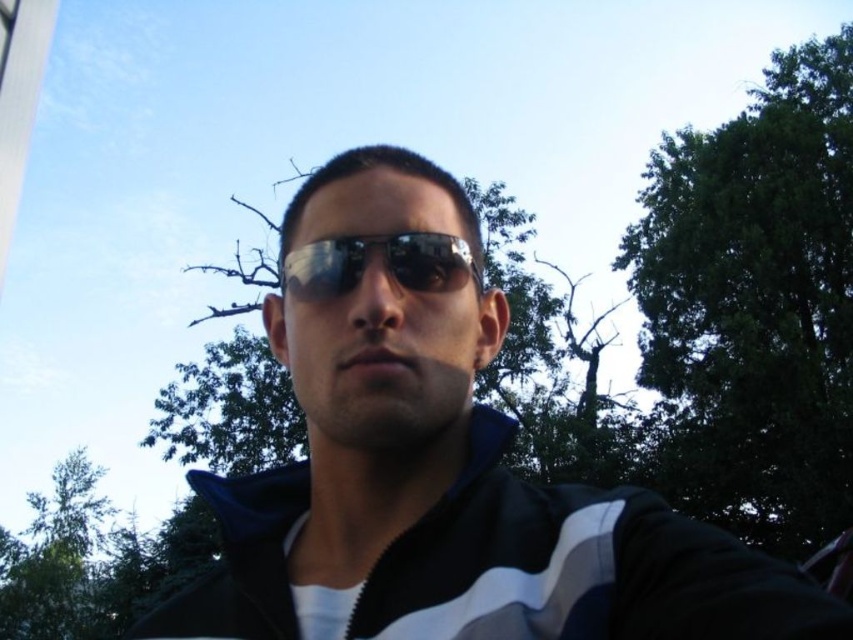
Who is shorter, black matte sunglasses at center or shiny reflective sunglasses at center?

Standing shorter between the two is shiny reflective sunglasses at center.

Find the location of `black matte sunglasses at center`. black matte sunglasses at center is located at coordinates (451, 508).

Where is `black matte sunglasses at center`? black matte sunglasses at center is located at coordinates (451, 508).

The image size is (853, 640). In order to click on black matte sunglasses at center in this screenshot , I will do `click(451, 508)`.

In the scene shown: Which of these two, black/white jacket at center or shiny reflective sunglasses at center, stands taller?

black/white jacket at center

Which is in front, point (239, 497) or point (479, 278)?

Point (239, 497)

The height and width of the screenshot is (640, 853). Find the location of `black/white jacket at center`. black/white jacket at center is located at coordinates (576, 566).

Where is `black/white jacket at center`? black/white jacket at center is located at coordinates (576, 566).

Between black matte sunglasses at center and black/white jacket at center, which one has more height?

With more height is black matte sunglasses at center.

Who is positioned more to the right, black matte sunglasses at center or black/white jacket at center?

Positioned to the right is black/white jacket at center.

Where is `black matte sunglasses at center`? Image resolution: width=853 pixels, height=640 pixels. black matte sunglasses at center is located at coordinates (451, 508).